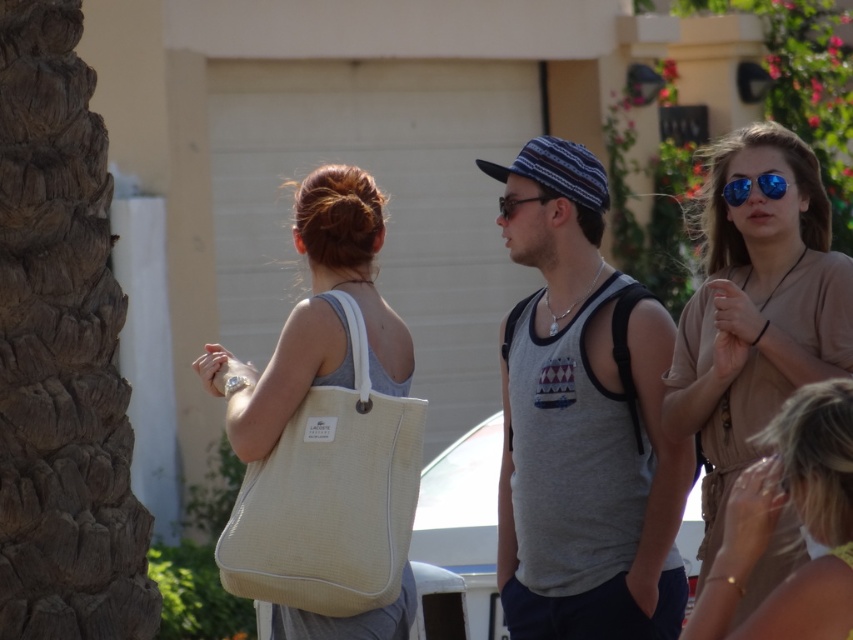
Between matte brown dress at center and clear plastic goggles at center, which one is positioned lower?

clear plastic goggles at center

Between matte brown dress at center and clear plastic goggles at center, which one has more height?

With more height is matte brown dress at center.

Where is `matte brown dress at center`? matte brown dress at center is located at coordinates (755, 308).

The height and width of the screenshot is (640, 853). I want to click on matte brown dress at center, so click(755, 308).

Measure the distance from gray cotton tank top at center to beige fabric dress at lower right.

The distance of gray cotton tank top at center from beige fabric dress at lower right is 2.48 meters.

Who is more forward, (525, 483) or (811, 442)?

Point (811, 442)

Where is `gray cotton tank top at center`? The width and height of the screenshot is (853, 640). gray cotton tank top at center is located at coordinates (583, 422).

Where is `gray cotton tank top at center`? gray cotton tank top at center is located at coordinates (583, 422).

Does gray cotton tank top at center have a larger size compared to clear plastic goggles at center?

Indeed, gray cotton tank top at center has a larger size compared to clear plastic goggles at center.

Is gray cotton tank top at center to the left of clear plastic goggles at center from the viewer's perspective?

In fact, gray cotton tank top at center is to the right of clear plastic goggles at center.

Between point (618, 624) and point (540, 202), which one is positioned in front?

Point (618, 624) is more forward.

At what (x,y) coordinates should I click in order to perform the action: click on gray cotton tank top at center. Please return your answer as a coordinate pair (x, y). The image size is (853, 640). Looking at the image, I should click on (x=583, y=422).